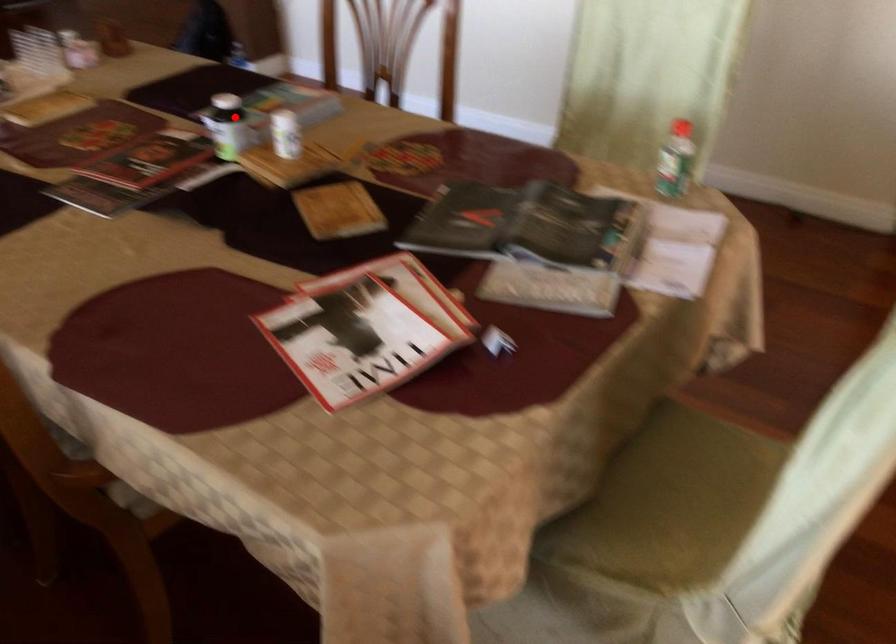
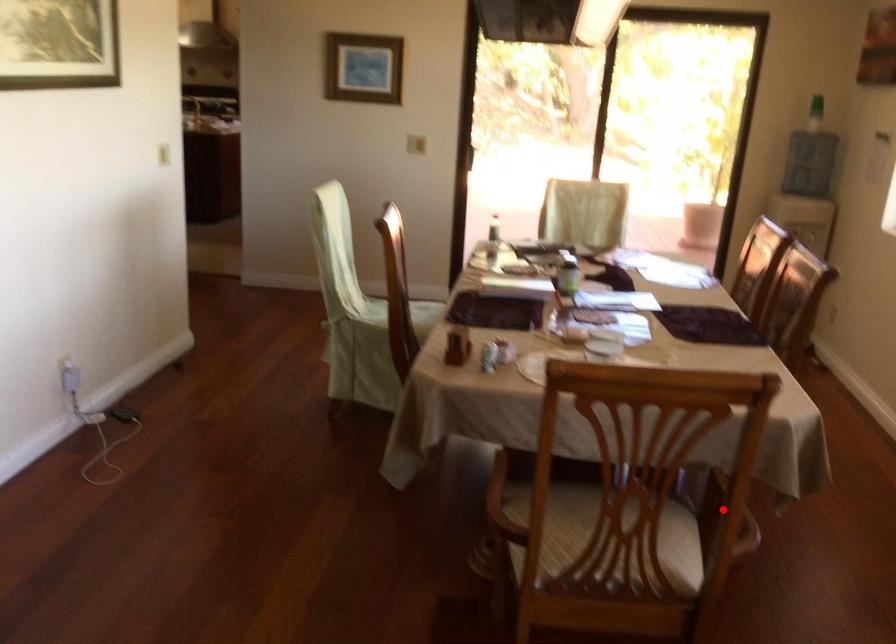
I am providing you with two images of the same scene from different viewpoints. A red point is marked on the first image and another point is marked on the second image. Do the highlighted points in image1 and image2 indicate the same real-world spot?

No